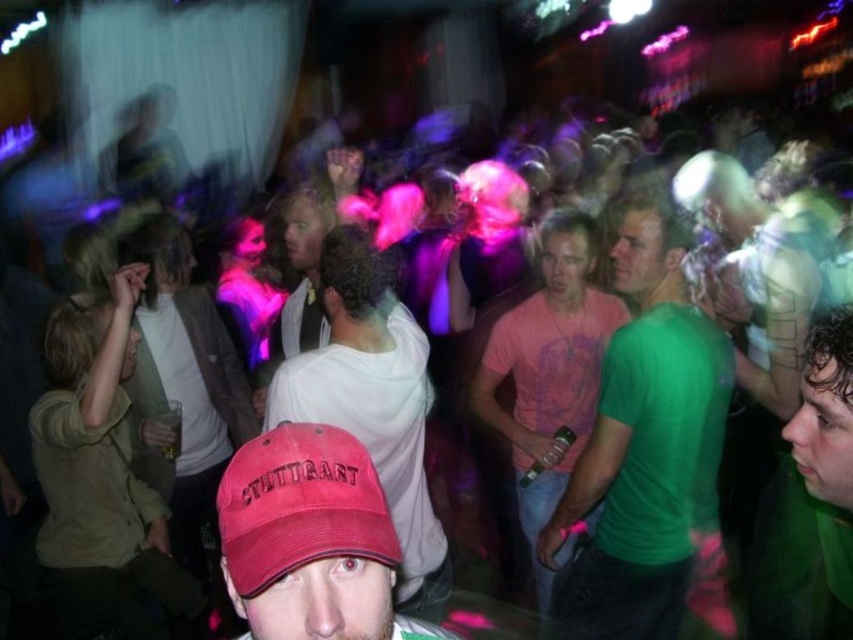
Can you confirm if white matte shirt at center is thinner than matte red baseball cap at center?

No.

Between point (431, 509) and point (239, 477), which one is positioned behind?

Point (431, 509)

This screenshot has height=640, width=853. Find the location of `white matte shirt at center`. white matte shirt at center is located at coordinates (372, 400).

Does green matte shirt at right have a smaller size compared to matte red baseball cap at center?

Actually, green matte shirt at right might be larger than matte red baseball cap at center.

Does point (810, 547) come closer to viewer compared to point (264, 445)?

No, it is not.

In order to click on green matte shirt at right in this screenshot , I will do `click(809, 502)`.

At what (x,y) coordinates should I click in order to perform the action: click on green matte shirt at right. Please return your answer as a coordinate pair (x, y). This screenshot has height=640, width=853. Looking at the image, I should click on (809, 502).

Can you confirm if green matte shirt at center is positioned above pink cotton t-shirt at center?

Indeed, green matte shirt at center is positioned over pink cotton t-shirt at center.

Does green matte shirt at center appear under pink cotton t-shirt at center?

Incorrect, green matte shirt at center is not positioned below pink cotton t-shirt at center.

Is point (700, 324) closer to viewer compared to point (556, 362)?

Yes.

Image resolution: width=853 pixels, height=640 pixels. Find the location of `green matte shirt at center`. green matte shirt at center is located at coordinates coord(645,444).